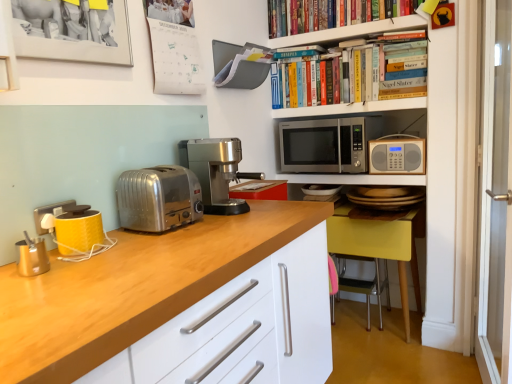
Question: Should I look upward or downward to see yellow wood chair at lower right, which is the 2th chair in back-to-front order?

Choices:
 (A) up
 (B) down

Answer: (B)

Question: Does yellow matte coffee machine at left, which ranks as the 1th coffee machine in left-to-right order, have a larger size compared to satin silver toaster at left?

Choices:
 (A) yes
 (B) no

Answer: (B)

Question: Is yellow matte coffee machine at left, which is the 1th coffee machine in front-to-back order, positioned in front of satin silver toaster at left?

Choices:
 (A) no
 (B) yes

Answer: (B)

Question: Is yellow matte coffee machine at left, which ranks as the 1th coffee machine in left-to-right order, turned away from satin silver toaster at left?

Choices:
 (A) yes
 (B) no

Answer: (B)

Question: From the image's perspective, would you say yellow matte coffee machine at left, the second coffee machine in the back-to-front sequence, is shown under satin silver toaster at left?

Choices:
 (A) yes
 (B) no

Answer: (A)

Question: Does yellow matte coffee machine at left, the second coffee machine in the back-to-front sequence, have a greater width compared to satin silver toaster at left?

Choices:
 (A) yes
 (B) no

Answer: (B)

Question: Can you confirm if yellow matte coffee machine at left, the second coffee machine in the back-to-front sequence, is positioned to the left of satin silver toaster at left?

Choices:
 (A) yes
 (B) no

Answer: (A)

Question: Is yellow wood chair at lower right, the 1th chair positioned from the front, bigger than hardcover books at upper center, marked as the second shelf in a top-to-bottom arrangement?

Choices:
 (A) no
 (B) yes

Answer: (B)

Question: Does yellow wood chair at lower right, the 1th chair positioned from the front, come behind hardcover books at upper center, the 1th shelf ordered from the bottom?

Choices:
 (A) yes
 (B) no

Answer: (A)

Question: Is yellow wood chair at lower right, the 1th chair positioned from the front, smaller than hardcover books at upper center, the 1th shelf ordered from the bottom?

Choices:
 (A) yes
 (B) no

Answer: (B)

Question: Would you say yellow wood chair at lower right, the 1th chair positioned from the front, is a long distance from hardcover books at upper center, marked as the second shelf in a top-to-bottom arrangement?

Choices:
 (A) yes
 (B) no

Answer: (B)

Question: Considering the relative sizes of yellow wood chair at lower right, which is the 2th chair in back-to-front order, and hardcover books at upper center, marked as the second shelf in a top-to-bottom arrangement, in the image provided, is yellow wood chair at lower right, which is the 2th chair in back-to-front order, thinner than hardcover books at upper center, marked as the second shelf in a top-to-bottom arrangement,?

Choices:
 (A) no
 (B) yes

Answer: (A)

Question: Is yellow wood chair at lower right, which is the 2th chair in back-to-front order, oriented towards hardcover books at upper center, marked as the second shelf in a top-to-bottom arrangement?

Choices:
 (A) yes
 (B) no

Answer: (B)

Question: Considering the relative sizes of yellow matte coffee machine at left, which ranks as the 1th coffee machine in left-to-right order, and polished stainless steel coffee machine at center, which appears as the second coffee machine when viewed from the front, in the image provided, is yellow matte coffee machine at left, which ranks as the 1th coffee machine in left-to-right order, smaller than polished stainless steel coffee machine at center, which appears as the second coffee machine when viewed from the front,?

Choices:
 (A) yes
 (B) no

Answer: (A)